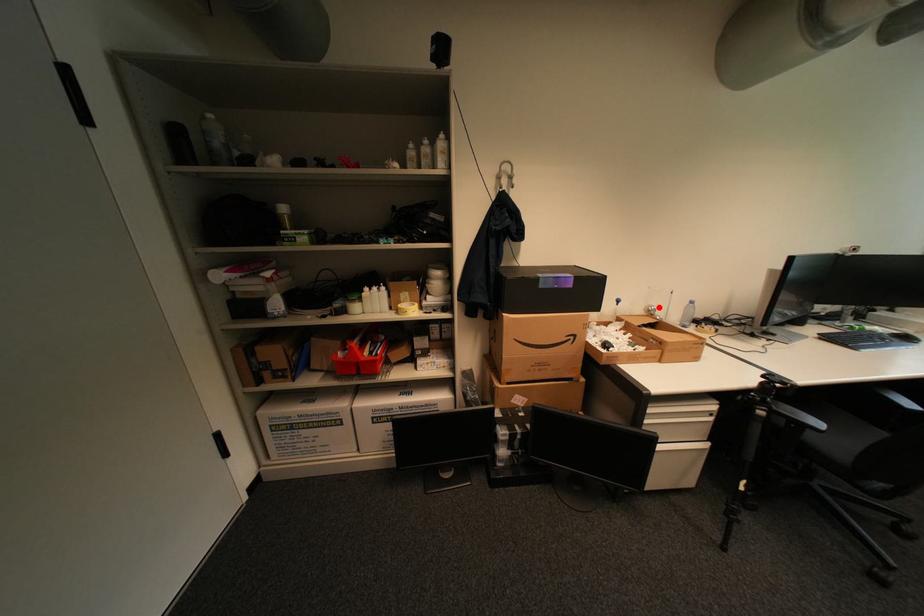
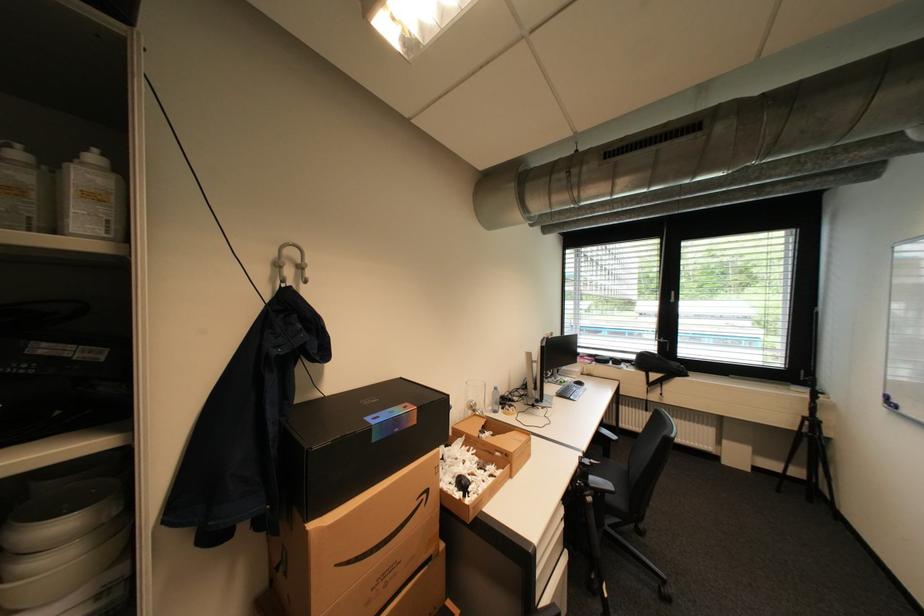
Question: I am providing you with two images of the same scene from different viewpoints. A red point is marked on the first image. At the location where the point appears in image 1, is it still visible in image 2?

Choices:
 (A) Yes
 (B) No

Answer: (A)